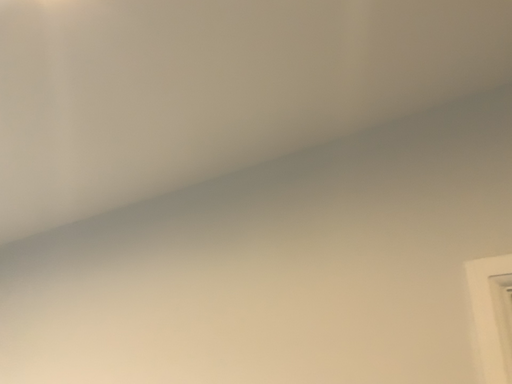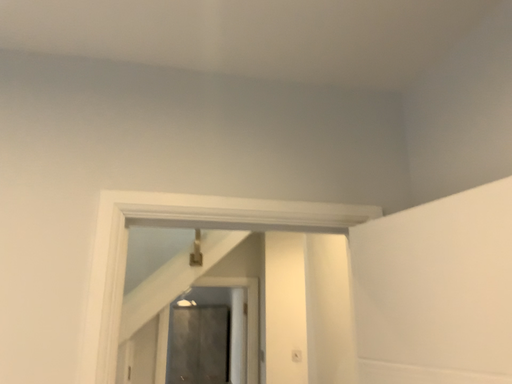
Question: How did the camera likely rotate when shooting the video?

Choices:
 (A) rotated left
 (B) rotated right

Answer: (B)